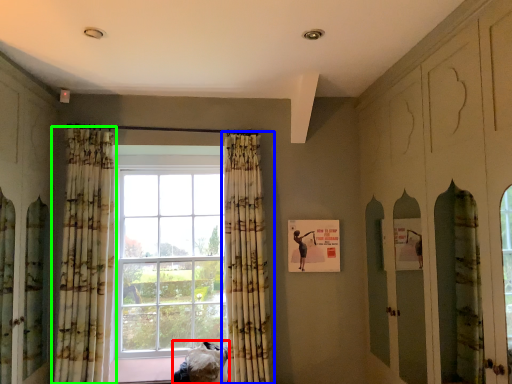
Question: Considering the real-world distances, which object is farthest from furniture (highlighted by a red box)? curtain (highlighted by a blue box) or curtain (highlighted by a green box)?

Choices:
 (A) curtain
 (B) curtain

Answer: (B)